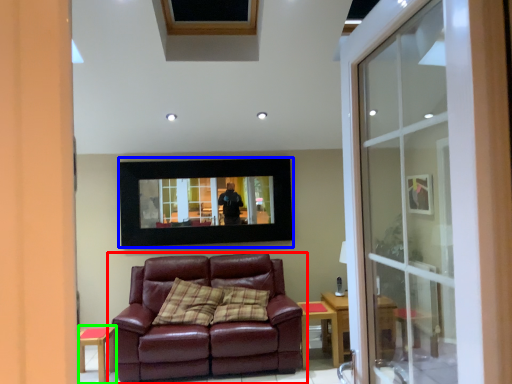
Question: Based on their relative distances, which object is nearer to studio couch (highlighted by a red box)? Choose from picture frame (highlighted by a blue box) and side table (highlighted by a green box).

Choices:
 (A) picture frame
 (B) side table

Answer: (B)